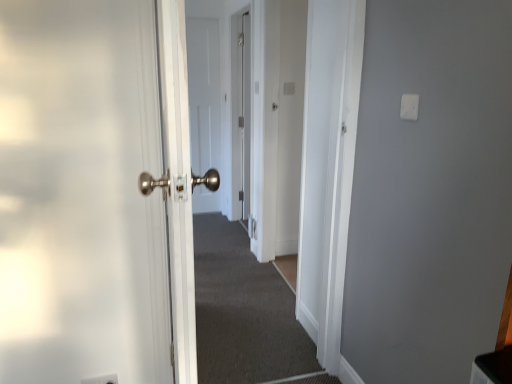
In order to face carpeted corridor at center, should I rotate leftwards or rightwards?

To align with it, rotate left about 4.267°.

Find the location of a particular element. The height and width of the screenshot is (384, 512). white matte door at center is located at coordinates (204, 93).

Find the location of a particular element. Image resolution: width=512 pixels, height=384 pixels. white plastic electric outlet at lower left is located at coordinates (101, 379).

The height and width of the screenshot is (384, 512). I want to click on carpeted corridor at center, so click(243, 311).

Are white matte door at center and carpeted corridor at center far apart?

white matte door at center is positioned a significant distance from carpeted corridor at center.

Is white matte door at center inside or outside of carpeted corridor at center?

white matte door at center cannot be found inside carpeted corridor at center.

From the image's perspective, which is above, white matte door at center or carpeted corridor at center?

white matte door at center, from the image's perspective.

From the picture: Is white matte door at center facing towards carpeted corridor at center?

Yes, white matte door at center is aimed at carpeted corridor at center.

Can white matte door at center be found inside carpeted corridor at center?

No, white matte door at center is not a part of carpeted corridor at center.

From the image's perspective, who appears lower, carpeted corridor at center or white matte door at center?

carpeted corridor at center, from the image's perspective.

Are carpeted corridor at center and white matte door at center located far from each other?

Absolutely, carpeted corridor at center is distant from white matte door at center.

Considering the relative positions of carpeted corridor at center and white matte door at center in the image provided, is carpeted corridor at center to the left or to the right of white matte door at center?

Based on their positions, carpeted corridor at center is located to the right of white matte door at center.

How many degrees apart are the facing directions of white matte door at center and white plastic light switch at upper right?

90.6 degrees.

Is white matte door at center next to white plastic light switch at upper right?

white matte door at center is not next to white plastic light switch at upper right, and they're not touching.

Considering their positions, is white matte door at center located in front of or behind white plastic light switch at upper right?

In the image, white matte door at center appears behind white plastic light switch at upper right.

Is white matte door at center taller or shorter than white plastic light switch at upper right?

Clearly, white matte door at center is taller compared to white plastic light switch at upper right.

From the picture: Who is taller, carpeted corridor at center or white plastic electric outlet at lower left?

white plastic electric outlet at lower left.

Does carpeted corridor at center turn towards white plastic electric outlet at lower left?

No.

Is carpeted corridor at center inside or outside of white plastic electric outlet at lower left?

carpeted corridor at center is not enclosed by white plastic electric outlet at lower left.

From the image's perspective, between carpeted corridor at center and white plastic electric outlet at lower left, which one is located above?

carpeted corridor at center is shown above in the image.

From a real-world perspective, is white plastic light switch at upper right physically above white matte door at center?

Yes, from a real-world perspective, white plastic light switch at upper right is on top of white matte door at center.

Between white plastic light switch at upper right and white matte door at center, which one has larger width?

white matte door at center.

Measure the distance from white plastic light switch at upper right to white matte door at center.

3.09 meters.

Is white plastic light switch at upper right oriented towards white matte door at center?

No.

Does white plastic light switch at upper right come behind white plastic electric outlet at lower left?

No, white plastic light switch at upper right is closer to the camera.

In terms of width, does white plastic light switch at upper right look wider or thinner when compared to white plastic electric outlet at lower left?

In the image, white plastic light switch at upper right appears to be more narrow than white plastic electric outlet at lower left.

Which of these two, white plastic light switch at upper right or white plastic electric outlet at lower left, stands taller?

white plastic electric outlet at lower left is taller.

Considering the relative sizes of white plastic light switch at upper right and white plastic electric outlet at lower left in the image provided, is white plastic light switch at upper right smaller than white plastic electric outlet at lower left?

Yes, white plastic light switch at upper right is smaller than white plastic electric outlet at lower left.

Which of these two, white matte door at center or white plastic electric outlet at lower left, stands shorter?

white plastic electric outlet at lower left is shorter.

What are the coordinates of `electric outlet on the left of the white matte door at center` in the screenshot? It's located at (101, 379).

From the image's perspective, is white matte door at center located beneath white plastic electric outlet at lower left?

No.

From a real-world perspective, does white matte door at center stand above white plastic electric outlet at lower left?

Correct, in the physical world, white matte door at center is higher than white plastic electric outlet at lower left.

This screenshot has height=384, width=512. I want to click on corridor below the white matte door at center (from a real-world perspective), so click(243, 311).

Image resolution: width=512 pixels, height=384 pixels. In order to click on corridor lying on the right of white matte door at center in this screenshot , I will do [243, 311].

Which object lies nearer to the anchor point white matte door at center, white plastic electric outlet at lower left or white plastic light switch at upper right?

white plastic electric outlet at lower left is positioned closer to the anchor white matte door at center.

Based on their spatial positions, is carpeted corridor at center or white matte door at center closer to white plastic light switch at upper right?

carpeted corridor at center.

When comparing their distances from carpeted corridor at center, does white plastic electric outlet at lower left or white plastic light switch at upper right seem closer?

The object closer to carpeted corridor at center is white plastic electric outlet at lower left.

Estimate the real-world distances between objects in this image. Which object is further from white plastic electric outlet at lower left, carpeted corridor at center or white plastic light switch at upper right?

white plastic light switch at upper right lies further to white plastic electric outlet at lower left than the other object.

When comparing their distances from white plastic light switch at upper right, does white plastic electric outlet at lower left or carpeted corridor at center seem further?

The object further to white plastic light switch at upper right is carpeted corridor at center.

From the picture: Which object lies nearer to the anchor point carpeted corridor at center, white matte door at center or white plastic light switch at upper right?

white matte door at center lies closer to carpeted corridor at center than the other object.

Based on their spatial positions, is white plastic electric outlet at lower left or white matte door at center further from carpeted corridor at center?

white plastic electric outlet at lower left lies further to carpeted corridor at center than the other object.

Based on their spatial positions, is white matte door at center or carpeted corridor at center closer to white plastic electric outlet at lower left?

Based on the image, carpeted corridor at center appears to be nearer to white plastic electric outlet at lower left.

Locate an element on the screen. corridor positioned between white plastic light switch at upper right and white matte door at center from near to far is located at coordinates (243, 311).

Find the location of `electric outlet between white plastic light switch at upper right and white matte door at center in the front-back direction`. electric outlet between white plastic light switch at upper right and white matte door at center in the front-back direction is located at coordinates (101, 379).

This screenshot has width=512, height=384. Identify the location of corridor between white plastic electric outlet at lower left and white plastic light switch at upper right in the horizontal direction. (243, 311).

Locate an element on the screen. The width and height of the screenshot is (512, 384). corridor between white plastic electric outlet at lower left and white matte door at center from front to back is located at coordinates (243, 311).